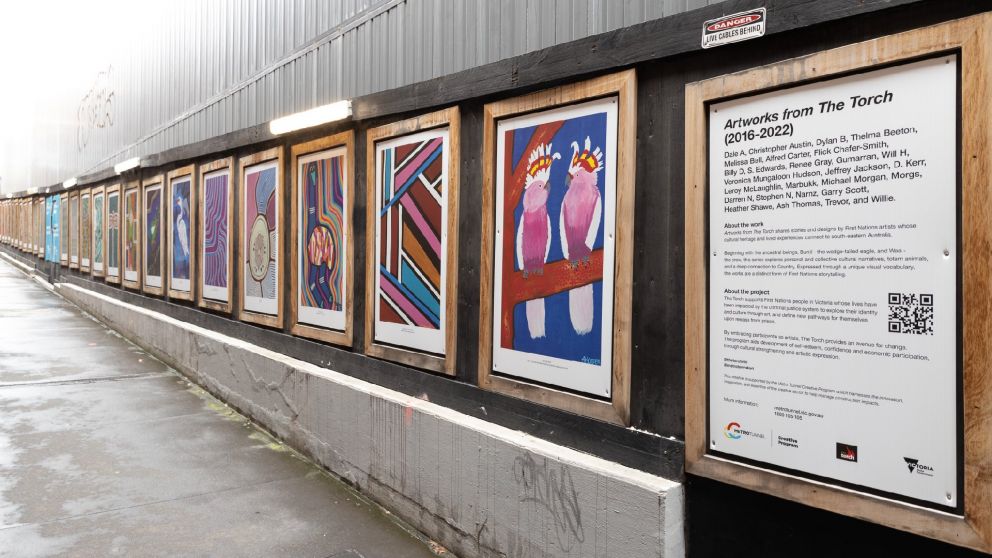
You are a GUI agent. You are given a task and a screenshot of the screen. Output one action in this format:
    pyautogui.click(x=<x>, y=<y>)
    Task: Click on the nearest light
    The width and height of the screenshot is (992, 558).
    Given the screenshot: What is the action you would take?
    pyautogui.click(x=316, y=115)